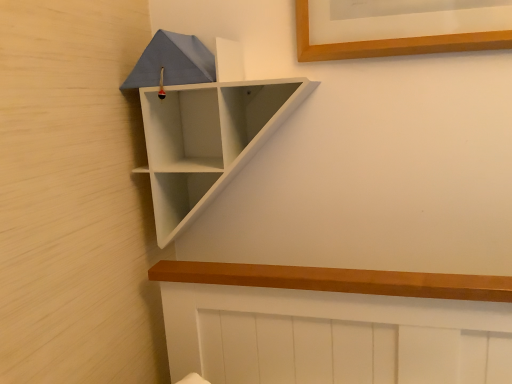
Locate an element on the screen. white matte shelf at upper left is located at coordinates (207, 140).

What do you see at coordinates (207, 140) in the screenshot? I see `white matte shelf at upper left` at bounding box center [207, 140].

The image size is (512, 384). In order to click on white matte shelf at upper left in this screenshot , I will do `click(207, 140)`.